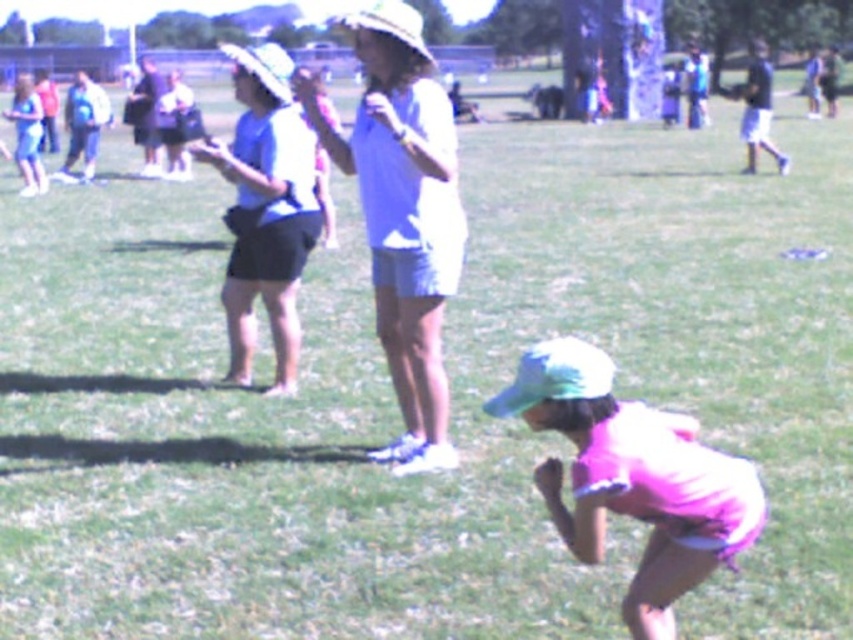
You are standing at the point with coordinates point (x=415, y=312) and want to walk towards the point with coordinates point (x=587, y=364). Which direction should you move relative to your current position?

Since point (x=415, y=312) is closer to the camera than point (x=587, y=364), you should move forward to reach it.

You are a photographer trying to capture the scene. You notice the pink fabric cap at lower right and the matte blue shirt at upper center. Which object is closer to the bottom edge of the photo?

The pink fabric cap at lower right is closer to the bottom edge of the photo because it is shorter than the matte blue shirt at upper center.

You are designing a layout for a magazine cover. The matte blue shirt at center and the pink fabric cap at lower right need to be placed side by side. Which object should be placed first if you want the wider object to be on the right side?

The pink fabric cap at lower right is wider than the matte blue shirt at center, so place the pink fabric cap at lower right on the right side and the matte blue shirt at center on the left side.